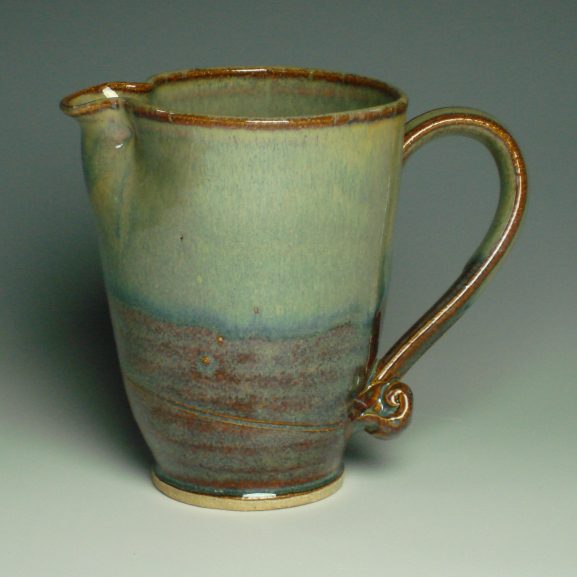
This screenshot has width=577, height=577. I want to click on handle, so click(409, 349), click(453, 127).